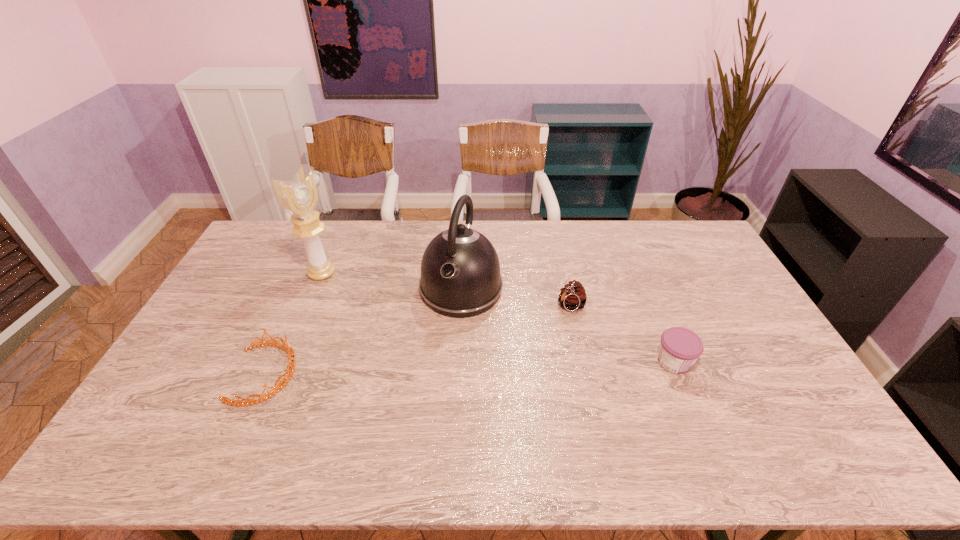
Where is `free spot between the kettle and the pinecone`? free spot between the kettle and the pinecone is located at coordinates (516, 298).

Find the location of a particular element. The width and height of the screenshot is (960, 540). vacant space that's between the award and the tiara is located at coordinates (294, 323).

Find the location of `blank region between the third object from left to right and the tiara`. blank region between the third object from left to right and the tiara is located at coordinates (364, 332).

This screenshot has width=960, height=540. In order to click on object that stands as the closest to the pinecone in this screenshot , I will do `click(460, 271)`.

Identify which object is the fourth nearest to the tiara. Please provide its 2D coordinates. Your answer should be formatted as a tuple, i.e. [(x, y)], where the tuple contains the x and y coordinates of a point satisfying the conditions above.

[(680, 347)]

This screenshot has width=960, height=540. I want to click on vacant region that satisfies the following two spatial constraints: 1. on the front side of the jam; 2. on the front label of the award, so click(x=285, y=362).